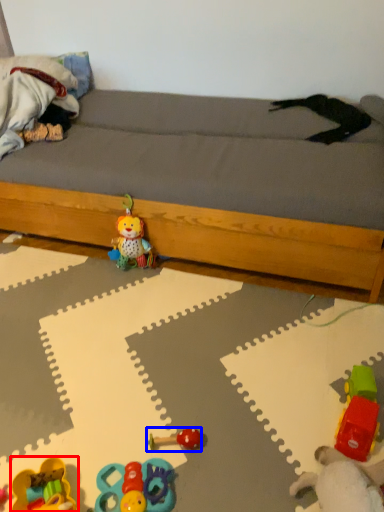
Question: Which of the following is the closest to the observer, toy (highlighted by a red box) or toy (highlighted by a blue box)?

Choices:
 (A) toy
 (B) toy

Answer: (A)